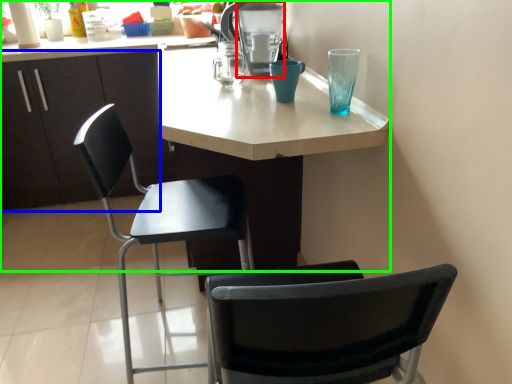
Question: Based on their relative distances, which object is farther from appliance (highlighted by a red box)? Choose from cabinetry (highlighted by a blue box) and desk (highlighted by a green box).

Choices:
 (A) cabinetry
 (B) desk

Answer: (A)